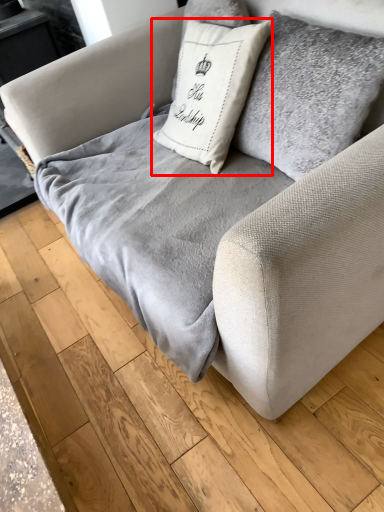
Question: From the image's perspective, considering the relative positions of pillow (annotated by the red box) and blanket in the image provided, where is pillow (annotated by the red box) located with respect to the staircase?

Choices:
 (A) above
 (B) below

Answer: (A)